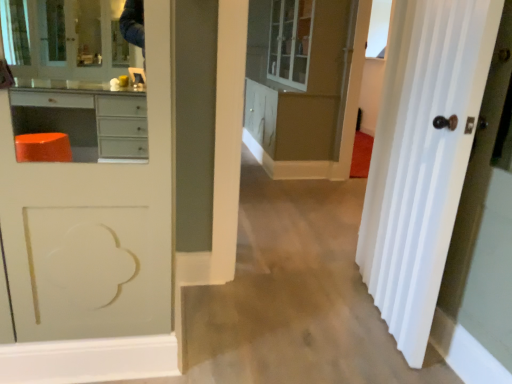
Question: From the image's perspective, would you say transparent glass window at upper right is shown under matte white cabinet at center?

Choices:
 (A) no
 (B) yes

Answer: (A)

Question: Does transparent glass window at upper right have a lesser height compared to matte white cabinet at center?

Choices:
 (A) yes
 (B) no

Answer: (A)

Question: Can you confirm if transparent glass window at upper right is wider than matte white cabinet at center?

Choices:
 (A) yes
 (B) no

Answer: (B)

Question: Is transparent glass window at upper right oriented away from matte white cabinet at center?

Choices:
 (A) no
 (B) yes

Answer: (A)

Question: Is the surface of transparent glass window at upper right in direct contact with matte white cabinet at center?

Choices:
 (A) no
 (B) yes

Answer: (A)

Question: Considering their positions, is matte white cabinet at center located in front of or behind transparent glass window at upper right?

Choices:
 (A) front
 (B) behind

Answer: (A)

Question: In terms of width, does matte white cabinet at center look wider or thinner when compared to transparent glass window at upper right?

Choices:
 (A) wide
 (B) thin

Answer: (A)

Question: Is matte white cabinet at center taller or shorter than transparent glass window at upper right?

Choices:
 (A) short
 (B) tall

Answer: (B)

Question: Is matte white cabinet at center to the left or to the right of transparent glass window at upper right in the image?

Choices:
 (A) right
 (B) left

Answer: (B)

Question: From the image's perspective, relative to matte white cabinet at center, is white glossy door at right above or below?

Choices:
 (A) above
 (B) below

Answer: (B)

Question: Looking at the image, does white glossy door at right seem bigger or smaller compared to matte white cabinet at center?

Choices:
 (A) big
 (B) small

Answer: (B)

Question: Looking at their shapes, would you say white glossy door at right is wider or thinner than matte white cabinet at center?

Choices:
 (A) thin
 (B) wide

Answer: (A)

Question: From a real-world perspective, is white glossy door at right physically located above or below matte white cabinet at center?

Choices:
 (A) above
 (B) below

Answer: (B)

Question: Choose the correct answer: Is transparent glass window at upper right inside white glossy door at right or outside it?

Choices:
 (A) inside
 (B) outside

Answer: (B)

Question: Is point [x=370, y=49] positioned closer to the camera than point [x=435, y=306]?

Choices:
 (A) farther
 (B) closer

Answer: (A)